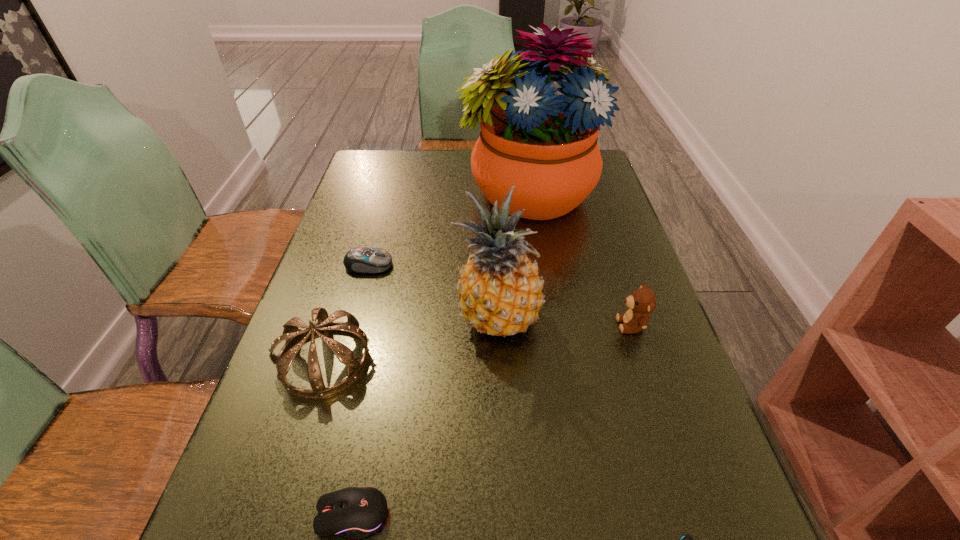
Image resolution: width=960 pixels, height=540 pixels. I want to click on vacant space at the left edge, so (x=358, y=192).

You are a GUI agent. You are given a task and a screenshot of the screen. Output one action in this format:
    pyautogui.click(x=<x>, y=<y>)
    Task: Click on the free space at the right edge of the desktop
    
    Given the screenshot: What is the action you would take?
    pyautogui.click(x=662, y=454)

Where is `vacant space at the far left corner`? The image size is (960, 540). vacant space at the far left corner is located at coordinates (377, 151).

The height and width of the screenshot is (540, 960). Identify the location of vacant space in between the fifth shortest object and the farthest object. (426, 277).

Find the location of a particular element. The width and height of the screenshot is (960, 540). vacant point located between the second farthest object and the flower arrangement is located at coordinates [x=448, y=230].

At what (x,y) coordinates should I click in order to perform the action: click on vacant space that is in between the second tallest object and the farthest mouse. Please return your answer as a coordinate pair (x, y). The height and width of the screenshot is (540, 960). Looking at the image, I should click on (433, 292).

Find the location of a particular element. the third closest object to the sixth nearest object is located at coordinates (545, 144).

At what (x,y) coordinates should I click in order to perform the action: click on the second closest object to the flower arrangement. Please return your answer as a coordinate pair (x, y). Looking at the image, I should click on (500, 292).

The width and height of the screenshot is (960, 540). I want to click on mouse that is the third nearest to the fifth shortest object, so click(686, 539).

The height and width of the screenshot is (540, 960). Find the location of `the second closest mouse to the shortest mouse`. the second closest mouse to the shortest mouse is located at coordinates click(366, 260).